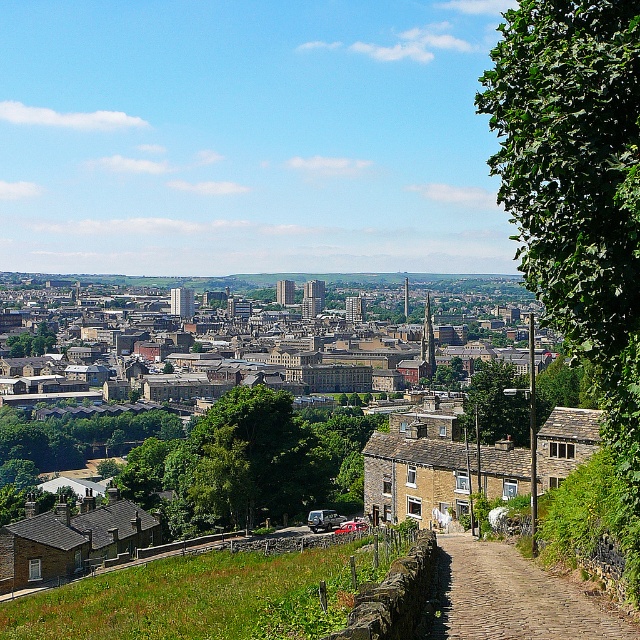
Is green leafy tree at right bigger than brown cobblestone path at lower right?

Correct, green leafy tree at right is larger in size than brown cobblestone path at lower right.

Between green leafy tree at right and brown cobblestone path at lower right, which one appears on the left side from the viewer's perspective?

From the viewer's perspective, brown cobblestone path at lower right appears more on the left side.

The image size is (640, 640). What are the coordinates of `green leafy tree at right` in the screenshot? It's located at (579, 196).

Locate an element on the screen. green leafy tree at right is located at coordinates (579, 196).

Does brown cobblestone path at lower right appear on the left side of green leafy tree at lower left?

In fact, brown cobblestone path at lower right is to the right of green leafy tree at lower left.

Can you confirm if brown cobblestone path at lower right is wider than green leafy tree at lower left?

No, brown cobblestone path at lower right is not wider than green leafy tree at lower left.

Who is more distant from viewer, (x=486, y=616) or (x=74, y=458)?

The point (x=74, y=458) is behind.

In order to click on brown cobblestone path at lower right in this screenshot , I will do `click(512, 596)`.

Does green leafy tree at center appear on the left side of brown stone buildings at center?

In fact, green leafy tree at center is to the right of brown stone buildings at center.

How much distance is there between green leafy tree at center and brown stone buildings at center?

They are 347.83 meters apart.

Is point (280, 518) behind point (64, 316)?

That is False.

This screenshot has height=640, width=640. Identify the location of green leafy tree at center. (248, 465).